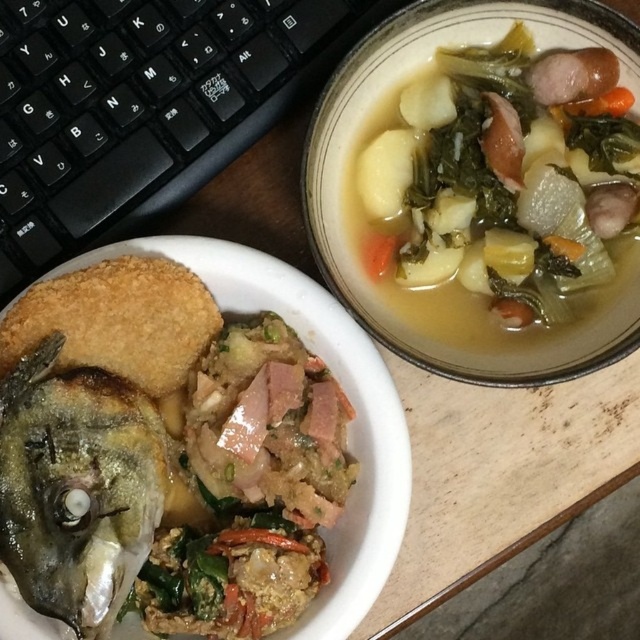
You are a chef trying to adjust the arrangement of dishes on a table. You have a shiny silver fish head at lower left and a golden crispy bread at upper left. If you want to move the golden crispy bread closer to the shiny silver fish head, how much distance do you need to reduce between them?

The current distance between the shiny silver fish head at lower left and the golden crispy bread at upper left is 2.64 inches. To move the golden crispy bread closer, you need to reduce this distance by the desired amount, but the exact reduction needed depends on how close you want them to be. The current separation is 2.64 inches.

You have two dishes in front of you on the table. The white matte bowl at center has a dish and the golden crispy bread at upper left is nearby. Which dish has a bigger serving size?

The white matte bowl at center has a bigger serving size because it is larger in size than the golden crispy bread at upper left.